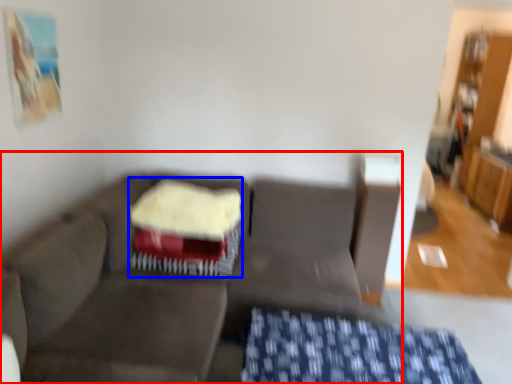
Question: Which object is closer to the camera taking this photo, studio couch (highlighted by a red box) or cake (highlighted by a blue box)?

Choices:
 (A) studio couch
 (B) cake

Answer: (A)